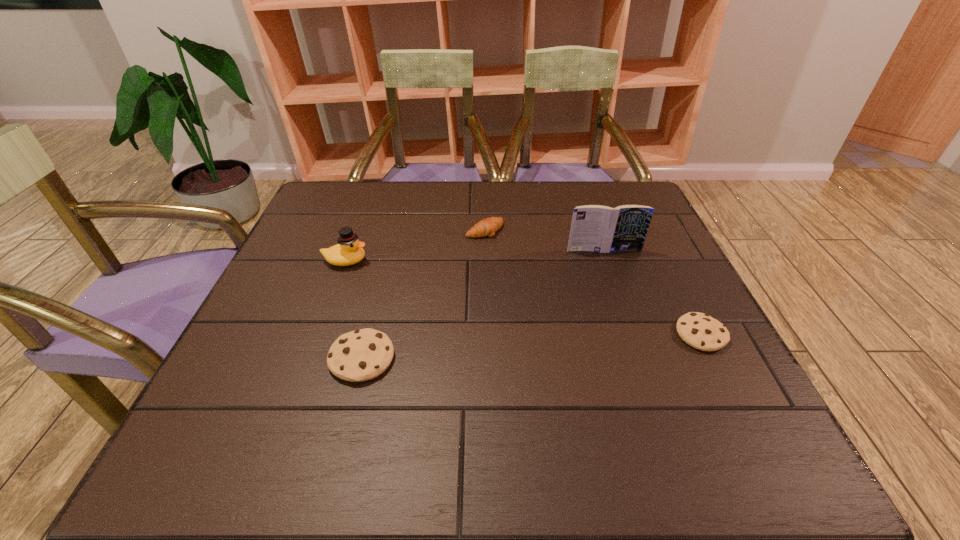
Image resolution: width=960 pixels, height=540 pixels. In order to click on the taller cookie in this screenshot , I will do `click(357, 356)`.

Find the location of a particular element. The height and width of the screenshot is (540, 960). the third tallest object is located at coordinates (357, 356).

The width and height of the screenshot is (960, 540). What are the coordinates of `the right cookie` in the screenshot? It's located at (701, 331).

The height and width of the screenshot is (540, 960). I want to click on book, so click(x=597, y=228).

At what (x,y) coordinates should I click in order to perform the action: click on the farthest object. Please return your answer as a coordinate pair (x, y). The image size is (960, 540). Looking at the image, I should click on (487, 227).

You are a GUI agent. You are given a task and a screenshot of the screen. Output one action in this format:
    pyautogui.click(x=<x>, y=<y>)
    Task: Click on the third object from right to left
    Image resolution: width=960 pixels, height=540 pixels.
    Given the screenshot: What is the action you would take?
    pyautogui.click(x=487, y=227)

Locate an element on the screen. This screenshot has width=960, height=540. the fourth shortest object is located at coordinates (349, 250).

The height and width of the screenshot is (540, 960). What are the coordinates of `vacant region located 0.280m on the back of the taller cookie` in the screenshot? It's located at (390, 250).

Locate an element on the screen. free location located 0.400m on the back of the right cookie is located at coordinates (640, 213).

The width and height of the screenshot is (960, 540). I want to click on free space located on the front cover of the tallest object, so click(x=630, y=324).